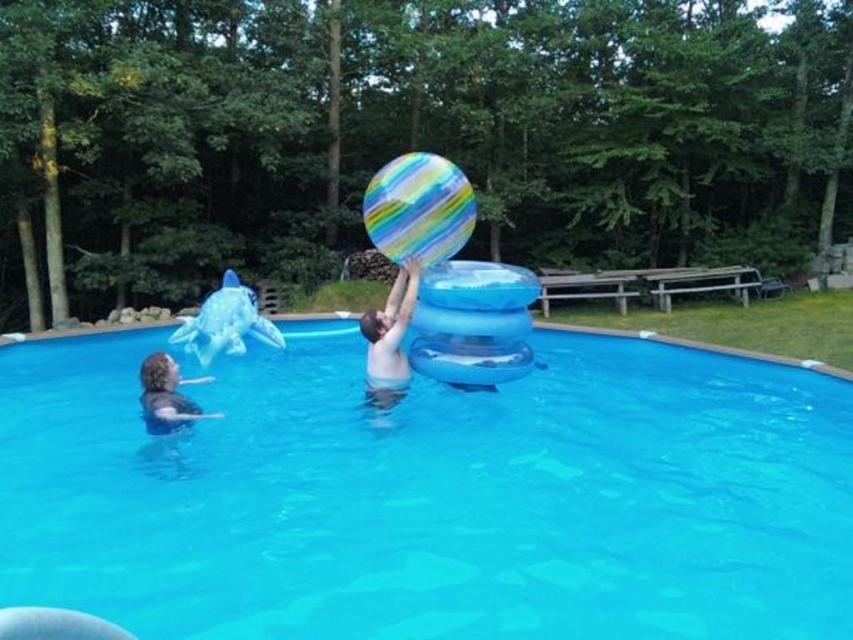
Question: From the image, what is the correct spatial relationship of smooth skin man at center in relation to dark gray shirt at lower left?

Choices:
 (A) below
 (B) above

Answer: (B)

Question: Does blue rubber shark at left appear under smooth skin man at center?

Choices:
 (A) no
 (B) yes

Answer: (A)

Question: Which object appears closest to the camera in this image?

Choices:
 (A) transparent blue pool at center
 (B) blue rubber shark at left
 (C) dark gray shirt at lower left

Answer: (A)

Question: Which object is closer to the camera taking this photo?

Choices:
 (A) blue rubber shark at left
 (B) transparent blue pool at center
 (C) multicolored striped beach ball at center

Answer: (B)

Question: Considering the real-world distances, which object is closest to the dark gray shirt at lower left?

Choices:
 (A) blue rubber shark at left
 (B) smooth skin man at center

Answer: (B)

Question: Does transparent blue pool at center lie in front of dark gray shirt at lower left?

Choices:
 (A) no
 (B) yes

Answer: (B)